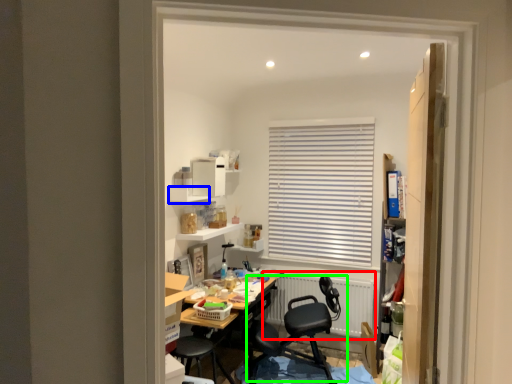
Question: Which object is the closest to the radiator (highlighted by a red box)? Choose among these: shelf (highlighted by a blue box) or chair (highlighted by a green box).

Choices:
 (A) shelf
 (B) chair

Answer: (B)